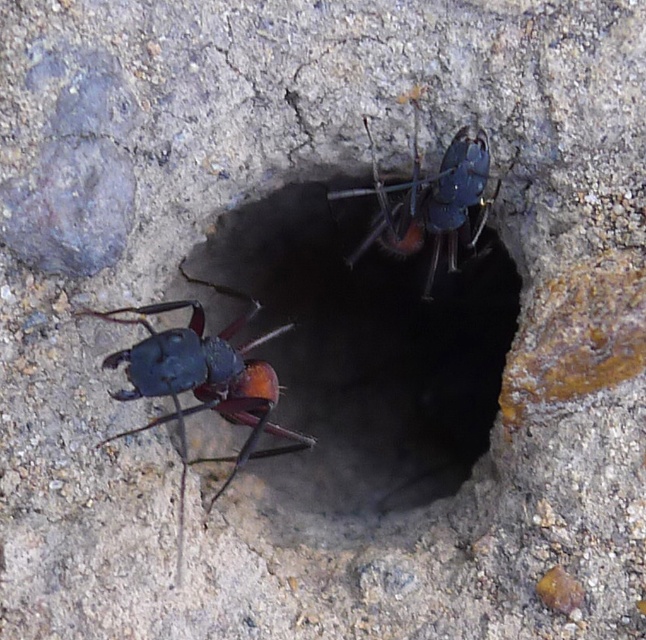
Question: Does shiny black ant at left lie behind shiny blue ant at upper center?

Choices:
 (A) no
 (B) yes

Answer: (A)

Question: Which of the following is the closest to the observer?

Choices:
 (A) (112, 362)
 (B) (397, 384)
 (C) (432, 198)

Answer: (A)

Question: Can you confirm if smooth concrete hole at center is positioned to the right of shiny blue ant at upper center?

Choices:
 (A) no
 (B) yes

Answer: (A)

Question: Does smooth concrete hole at center have a lesser width compared to shiny black ant at left?

Choices:
 (A) no
 (B) yes

Answer: (A)

Question: Based on their relative distances, which object is farther from the shiny blue ant at upper center?

Choices:
 (A) shiny black ant at left
 (B) smooth concrete hole at center

Answer: (A)

Question: Estimate the real-world distances between objects in this image. Which object is farther from the shiny blue ant at upper center?

Choices:
 (A) shiny black ant at left
 (B) smooth concrete hole at center

Answer: (A)